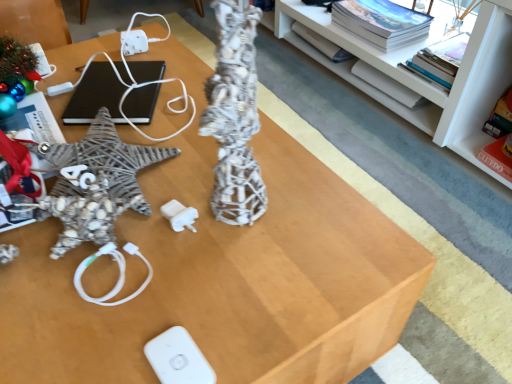
The image size is (512, 384). In order to click on vacant area that is situated to the right of white matte wii controller at lower center in this screenshot , I will do `click(275, 321)`.